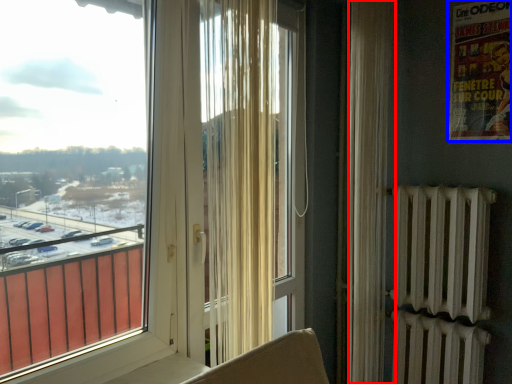
Question: Which point is closer to the camera, curtain (highlighted by a red box) or poster page (highlighted by a blue box)?

Choices:
 (A) curtain
 (B) poster page

Answer: (A)